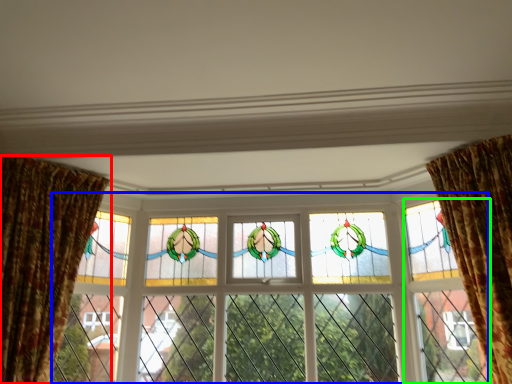
Question: Which object is the farthest from curtain (highlighted by a red box)? Choose among these: window (highlighted by a blue box) or glass door (highlighted by a green box).

Choices:
 (A) window
 (B) glass door

Answer: (B)